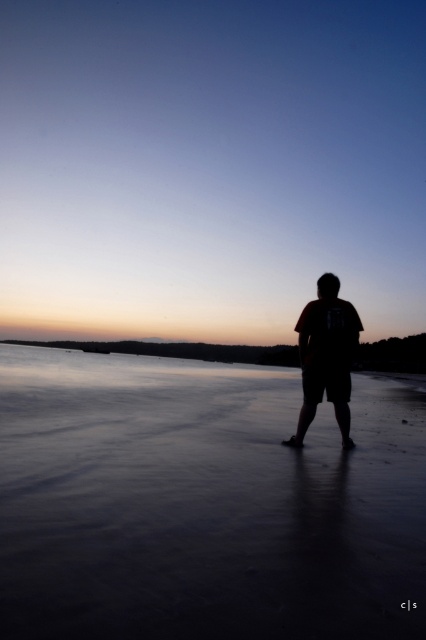
Between point (0, 448) and point (322, 288), which one is positioned in front?

Positioned in front is point (0, 448).

Is smooth sand at center to the left of silhouette t-shirt at center from the viewer's perspective?

Correct, you'll find smooth sand at center to the left of silhouette t-shirt at center.

Is point (193, 625) positioned before point (321, 317)?

Yes.

Locate an element on the screen. This screenshot has height=640, width=426. smooth sand at center is located at coordinates (204, 502).